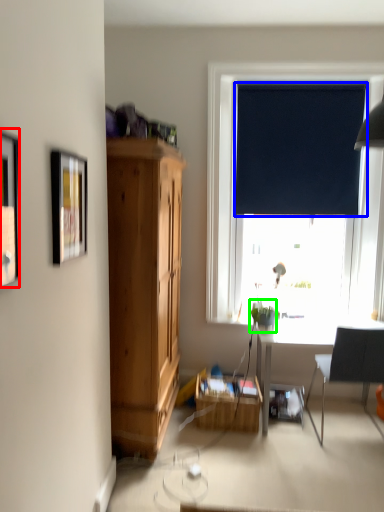
Question: Which is nearer to the picture frame (highlighted by a red box)? curtain (highlighted by a blue box) or houseplant (highlighted by a green box).

Choices:
 (A) curtain
 (B) houseplant

Answer: (B)